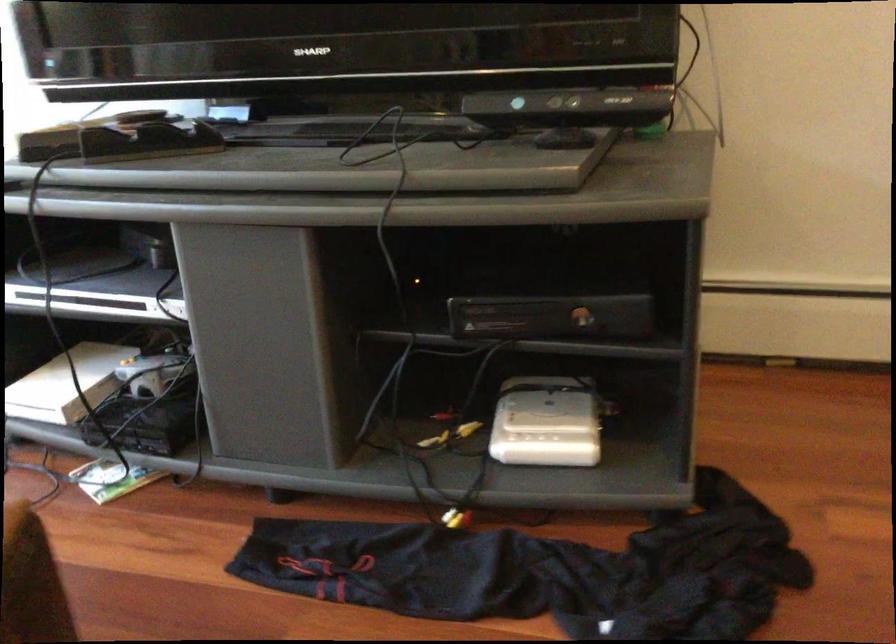
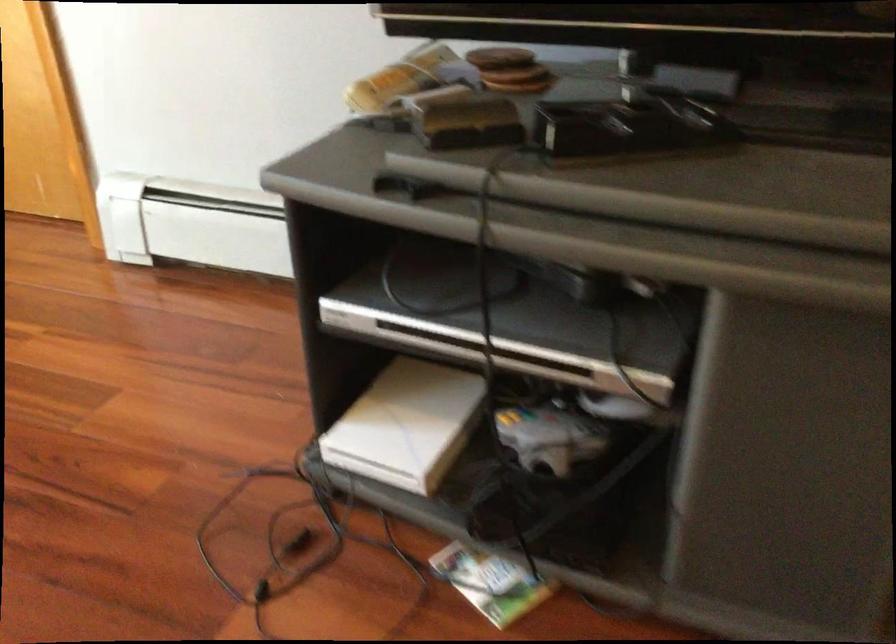
Question: How did the camera likely rotate?

Choices:
 (A) Left
 (B) Right
 (C) Up
 (D) Down

Answer: (D)